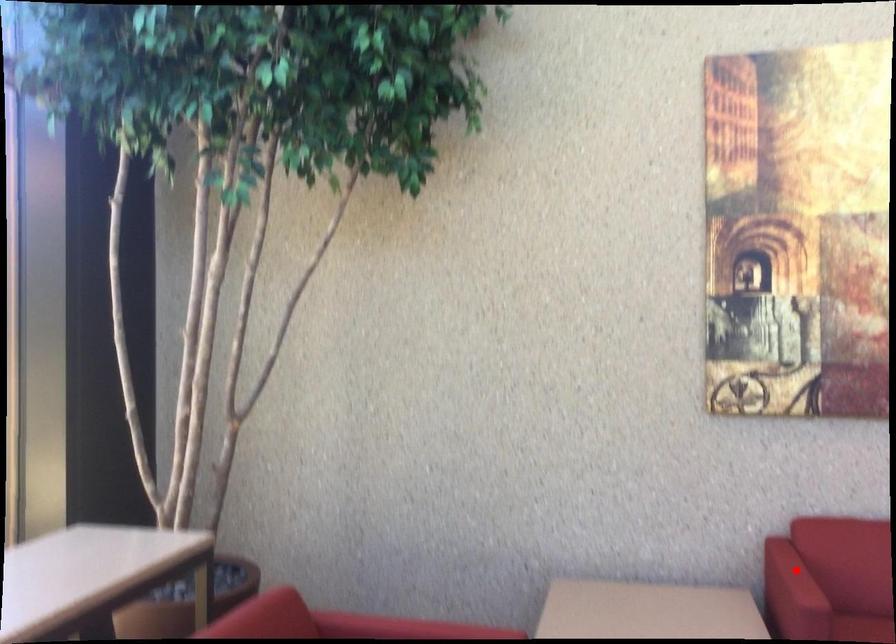
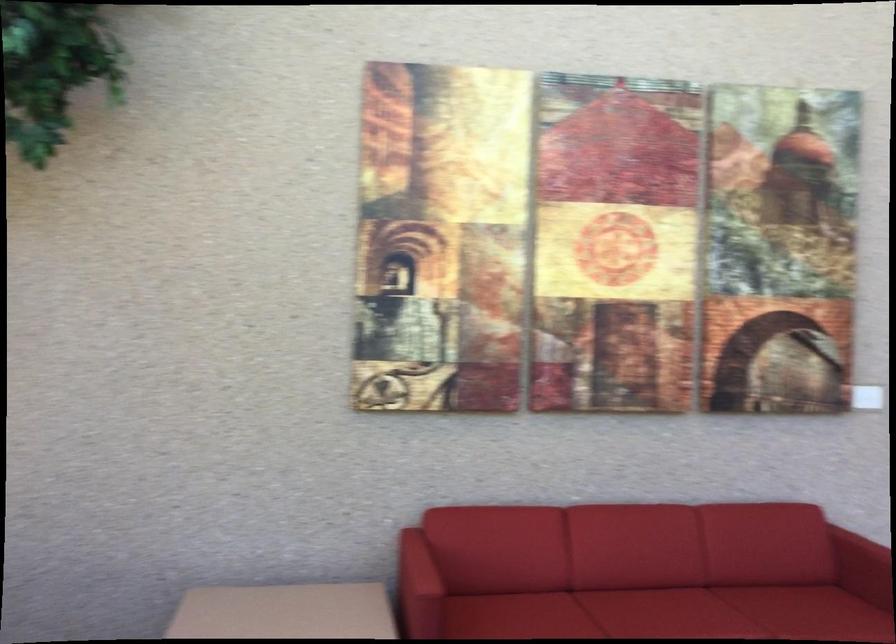
Find the pixel in the second image that matches the highlighted location in the first image.

(418, 564)